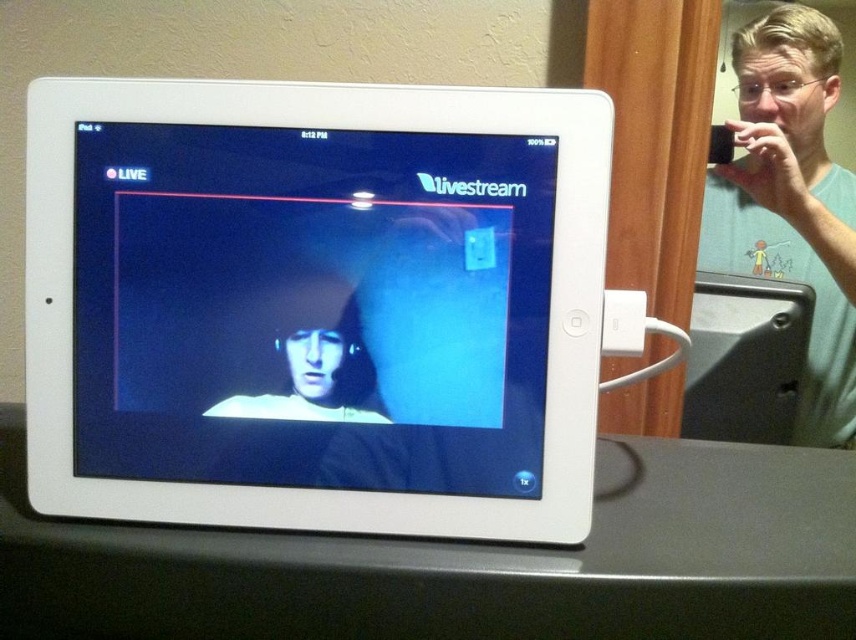
You are a delivery person who needs to place a package between the green matte phone at upper right and the matte black hoodie at center. The package is 18 inches long. Will it fit between them?

The distance between the green matte phone at upper right and the matte black hoodie at center is 32.66 inches. Since the package is 18 inches long, it will fit comfortably between them as there is enough space.

You are setting up a video call and need to ensure both devices are visible. Since the matte black screen at center and the green matte phone at upper right are in your view, which device is closer to you?

The matte black screen at center is closer to you since it is in front of the green matte phone at upper right.

You are setting up a video call and need to position your phone so that it can capture both the tablet and the person in the background. Given the current setup, where is the green matte phone at upper right located in relation to the tablet and the person in the background?

The green matte phone at upper right is located at point coordinates of 0.316 on the x axis and 0.925 on the y axis, so it is positioned in the upper right corner of the image frame. This placement allows it to capture both the tablet and the person in the background through its field of view.